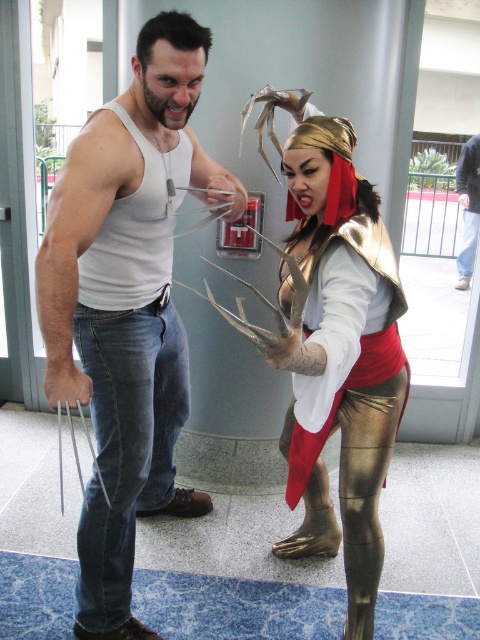
Can you confirm if matte white tank top at center is positioned above gold metallic pants at lower center?

Correct, matte white tank top at center is located above gold metallic pants at lower center.

Between matte white tank top at center and gold metallic pants at lower center, which one appears on the right side from the viewer's perspective?

gold metallic pants at lower center is more to the right.

Identify the location of matte white tank top at center. click(127, 305).

Does gold metallic costume at center have a greater width compared to gold metallic pants at lower center?

Correct, the width of gold metallic costume at center exceeds that of gold metallic pants at lower center.

Is point (289, 420) positioned behind point (377, 225)?

That is True.

In order to click on gold metallic costume at center in this screenshot , I will do `click(342, 358)`.

Is point (52, 195) behind point (292, 163)?

No.

Between point (111, 177) and point (336, 220), which one is positioned behind?

Point (336, 220)

Where is `matte white tank top at center`? The height and width of the screenshot is (640, 480). matte white tank top at center is located at coordinates (127, 305).